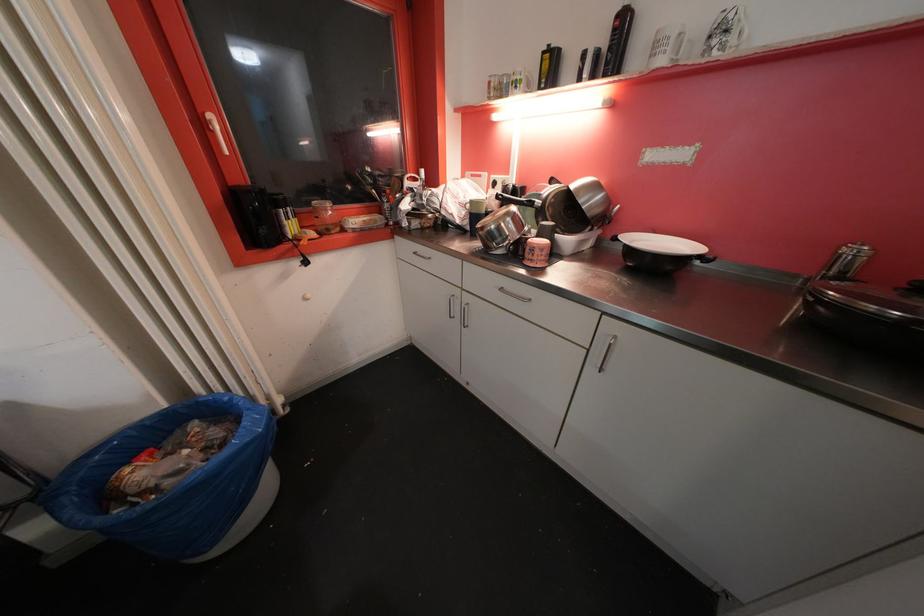
Which object does [617,41] point to?

It refers to a tall dark bottle.